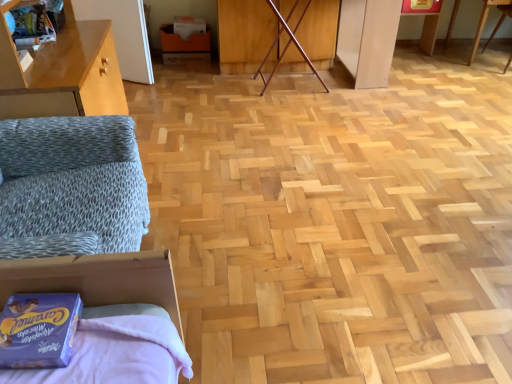
Question: Based on their positions, is blue cardboard box at lower left located to the left or right of wooden table at upper right?

Choices:
 (A) right
 (B) left

Answer: (B)

Question: From a real-world perspective, is blue cardboard box at lower left physically located above or below wooden table at upper right?

Choices:
 (A) above
 (B) below

Answer: (A)

Question: Which object is the farthest from the matte cardboard box at center?

Choices:
 (A) blue cardboard box at lower left
 (B) wooden table at upper right

Answer: (A)

Question: Which of these objects is positioned closest to the blue cardboard box at lower left?

Choices:
 (A) matte cardboard box at center
 (B) wooden table at upper right

Answer: (A)